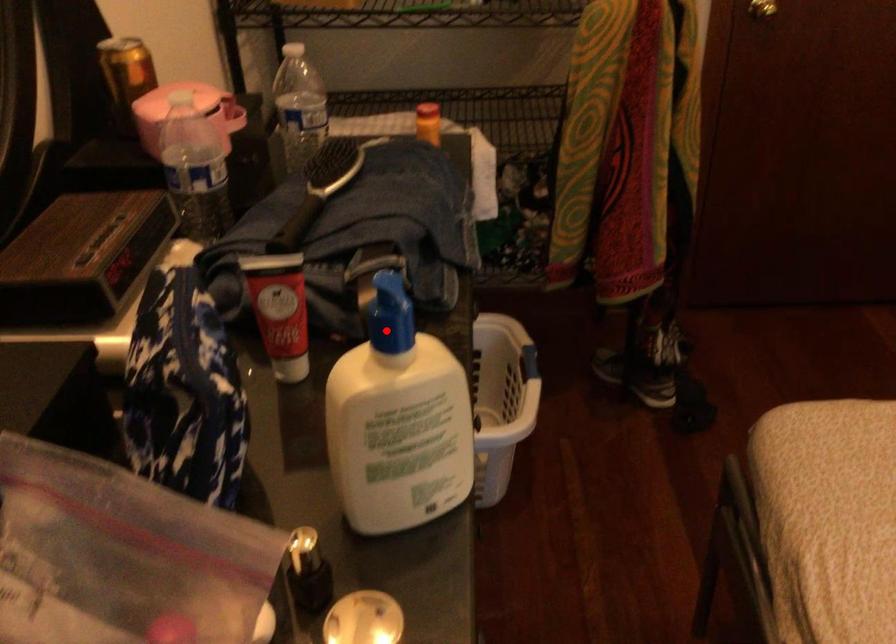
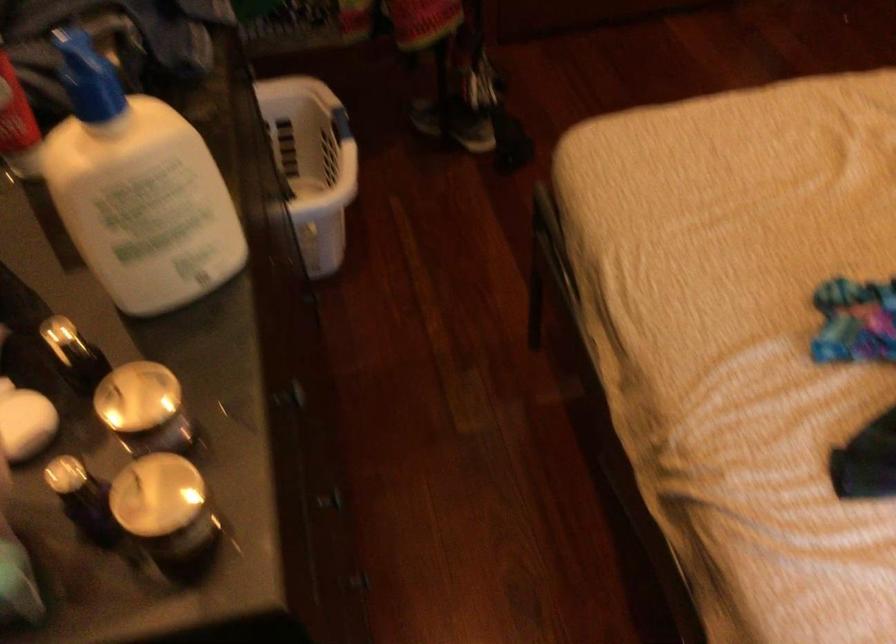
Question: A red point is marked in image1. In image2, is the corresponding 3D point closer to the camera or farther? Reply with the corresponding letter.

Choices:
 (A) The corresponding 3D point is closer.
 (B) The corresponding 3D point is farther.

Answer: (A)